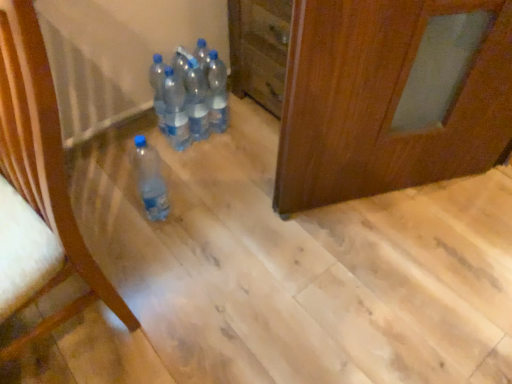
Find the location of a particular element. free space between clear plastic bottle at left and transparent plastic bottles at center, the first bottle positioned from the right is located at coordinates (165, 222).